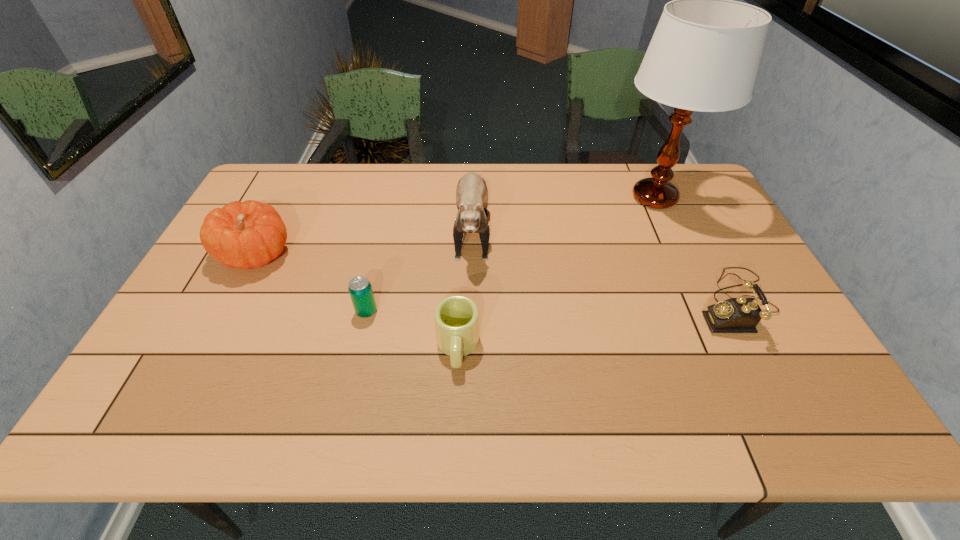
Image resolution: width=960 pixels, height=540 pixels. I want to click on the tallest object, so click(704, 55).

Where is `ferret`? The height and width of the screenshot is (540, 960). ferret is located at coordinates (471, 194).

At what (x,y) coordinates should I click in order to perform the action: click on pumpkin. Please return your answer as a coordinate pair (x, y). Looking at the image, I should click on (247, 235).

Locate an element on the screen. This screenshot has height=540, width=960. the leftmost object is located at coordinates (247, 235).

Identify the location of telephone. (735, 315).

Image resolution: width=960 pixels, height=540 pixels. I want to click on the second object from left to right, so click(360, 289).

I want to click on mug, so click(456, 317).

Locate an element on the screen. Image resolution: width=960 pixels, height=540 pixels. free space located on the front of the tallest object is located at coordinates click(706, 309).

I want to click on vacant space located 0.250m on the face of the ferret, so 469,351.

This screenshot has width=960, height=540. Identify the location of vacant space positioned on the front of the pumpkin. (207, 348).